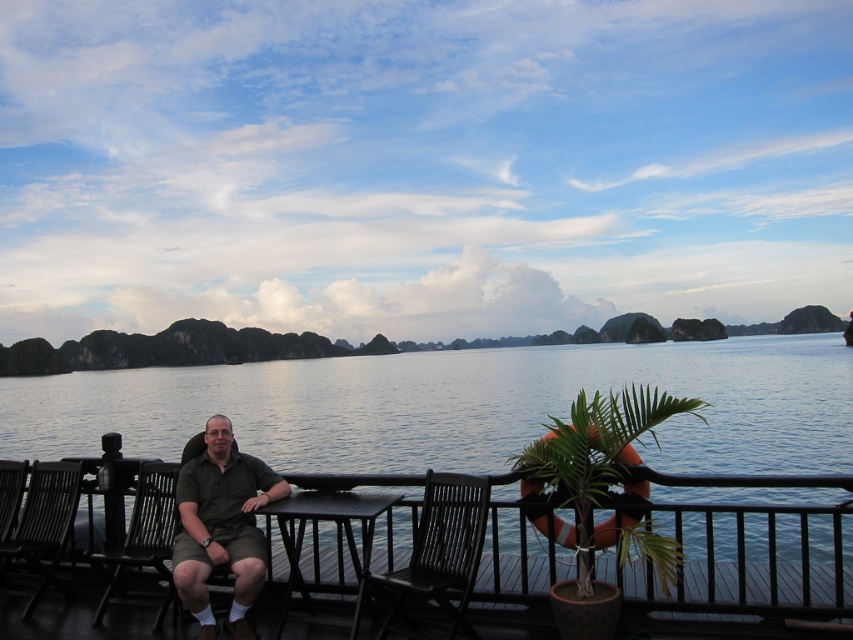
You are standing on the wooden deck and want to move from the green matte shirt at center to the black wood rail at center. Which direction should you move in?

The black wood rail at center is to the right of the green matte shirt at center, so you should move to the right to reach it.

You are standing on the deck and want to walk from the black wood chair at center to the black wood rail at center. Which direction should you move to reach the rail?

The black wood rail at center is positioned on the right side of the black wood chair at center, so you should move to the right to reach the rail.

You are planning to place a rectangular tray that is 1.2 meters wide on the deck. The tray must be placed between the green matte shirt at center and the black wood chair at left. Is there enough space for the tray?

The green matte shirt at center might be wider than black wood chair at left, so the space between them may not be sufficient to accommodate a 1.2 meter wide tray. Check the actual distance before placing the tray.